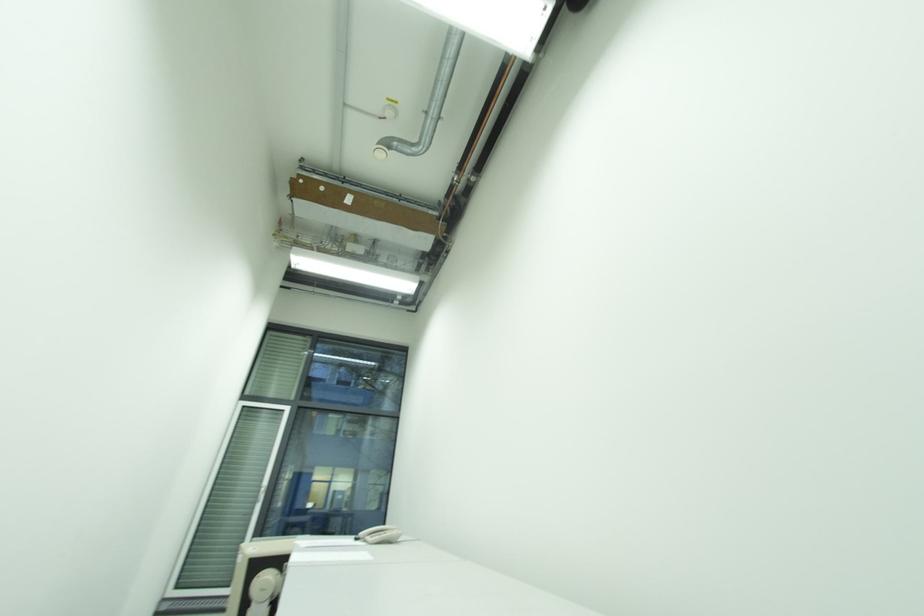
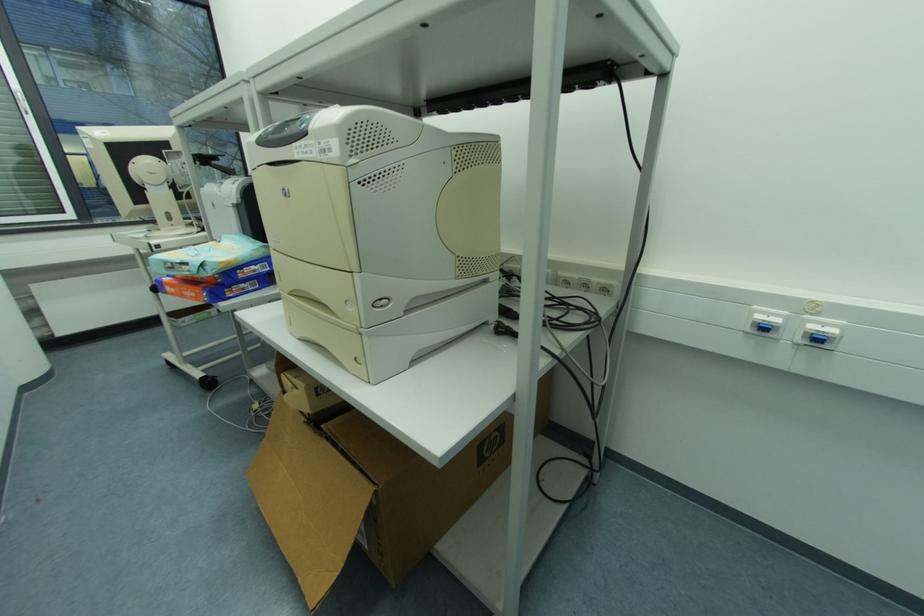
The images are taken continuously from a first-person perspective. In which direction is your viewpoint rotating?

The camera's rotation is toward right-down.